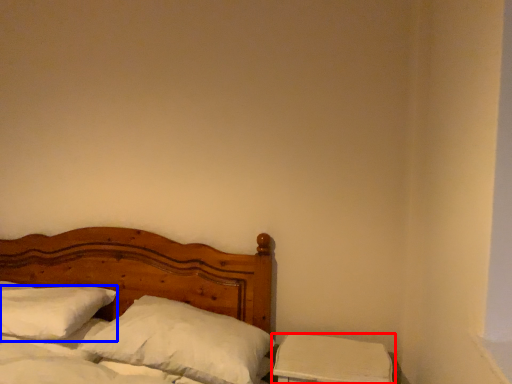
Question: Among these objects, which one is farthest to the camera, nightstand (highlighted by a red box) or pillow (highlighted by a blue box)?

Choices:
 (A) nightstand
 (B) pillow

Answer: (B)